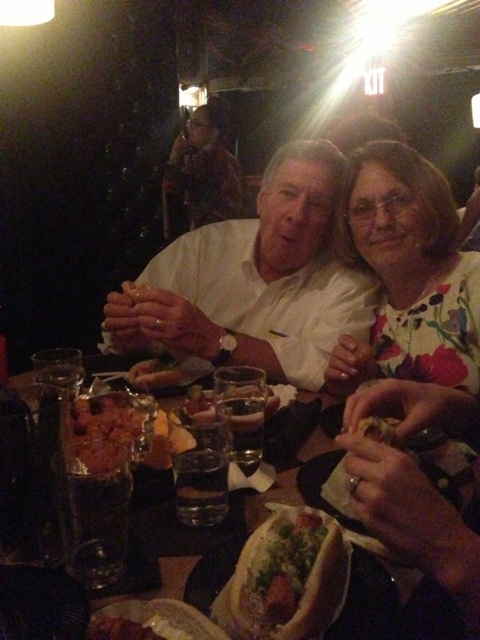
Based on the photo, is clear glass at center bigger than slightly translucent glass at center?

Actually, clear glass at center might be smaller than slightly translucent glass at center.

This screenshot has width=480, height=640. In order to click on clear glass at center in this screenshot , I will do `click(243, 428)`.

This screenshot has height=640, width=480. What are the coordinates of `clear glass at center` in the screenshot? It's located at (243, 428).

Between shiny metallic bowl at center and slightly translucent glass at center, which one has less height?

slightly translucent glass at center

Between shiny metallic bowl at center and slightly translucent glass at center, which one appears on the left side from the viewer's perspective?

Positioned to the left is shiny metallic bowl at center.

The image size is (480, 640). What do you see at coordinates (105, 429) in the screenshot? I see `shiny metallic bowl at center` at bounding box center [105, 429].

At what (x,y) coordinates should I click in order to perform the action: click on shiny metallic bowl at center. Please return your answer as a coordinate pair (x, y). This screenshot has width=480, height=640. Looking at the image, I should click on (105, 429).

Between white paper napkin at center and clear glass at center, which one appears on the left side from the viewer's perspective?

clear glass at center

Is white paper napkin at center thinner than clear glass at center?

No.

The image size is (480, 640). I want to click on white paper napkin at center, so click(x=415, y=520).